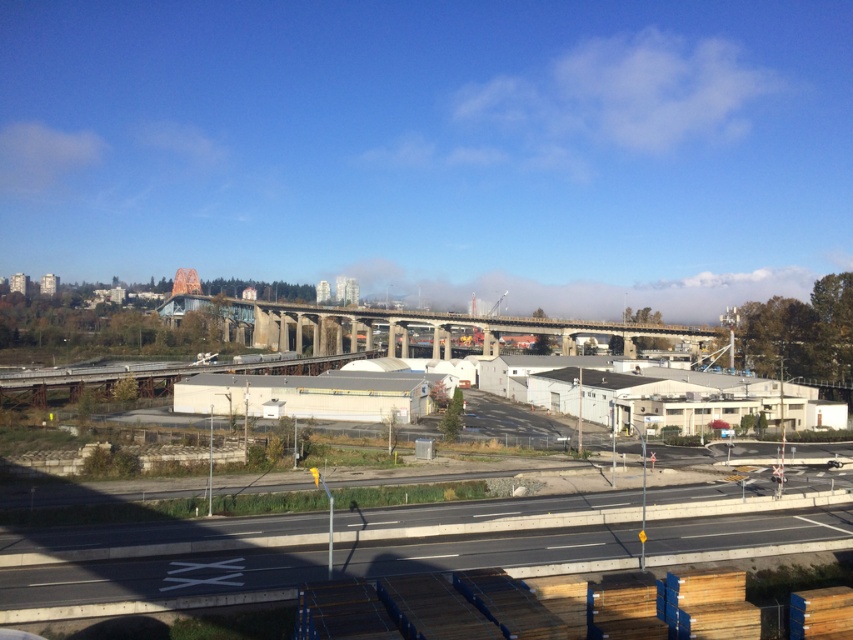
You are a delivery truck driver approaching the concrete bridge at center and the gray concrete train track at lower center. Which one would you encounter first?

You would encounter the concrete bridge at center first because it is closer to you than the gray concrete train track at lower center, which is further away.